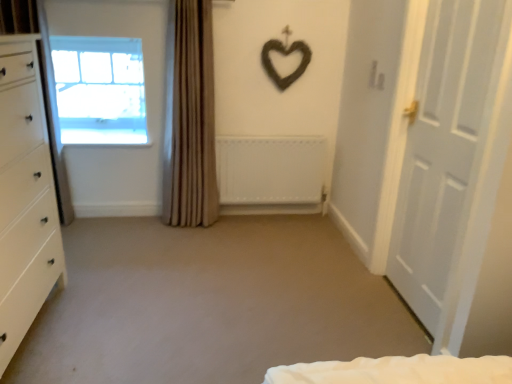
Question: In terms of height, does beige fabric curtain at center look taller or shorter compared to white matte radiator at center?

Choices:
 (A) short
 (B) tall

Answer: (B)

Question: Based on their sizes in the image, would you say beige fabric curtain at center is bigger or smaller than white matte radiator at center?

Choices:
 (A) big
 (B) small

Answer: (A)

Question: Considering the real-world distances, which object is farthest from the white matte door at right?

Choices:
 (A) white matte radiator at center
 (B) white glossy chest of drawers at left
 (C) transparent glass window at upper left
 (D) beige fabric curtain at center

Answer: (C)

Question: Which of these objects is positioned farthest from the white glossy chest of drawers at left?

Choices:
 (A) transparent glass window at upper left
 (B) white matte door at right
 (C) white matte radiator at center
 (D) beige fabric curtain at center

Answer: (B)